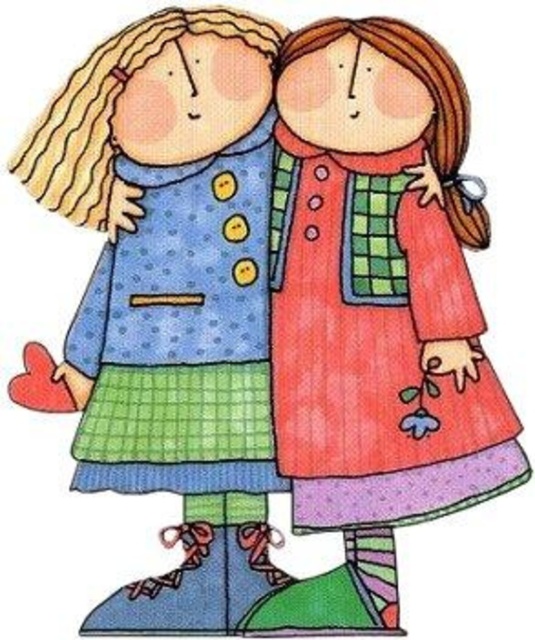
You are a photographer trying to capture a closeup shot of the red heart held by the character on the left. You notice two points in the scene labeled as point 1 at coordinates point (452, 333) and point 2 at coordinates point (231, 140). Which point should you focus on to ensure the red heart is in sharp focus?

You should focus on point 1 at coordinates point (452, 333) because it is closer to the viewer than point 2 at coordinates point (231, 140), ensuring the red heart held by the character on the left is in sharp focus.

You are a photographer standing 1.5 meters away from the scene. You want to take a photo of the point at coordinates point (479, 403). Is the point within your camera range?

The distance of point (479, 403) from camera is 1.22 meters, so the point is within the camera range since it is closer than the photographer is standing.